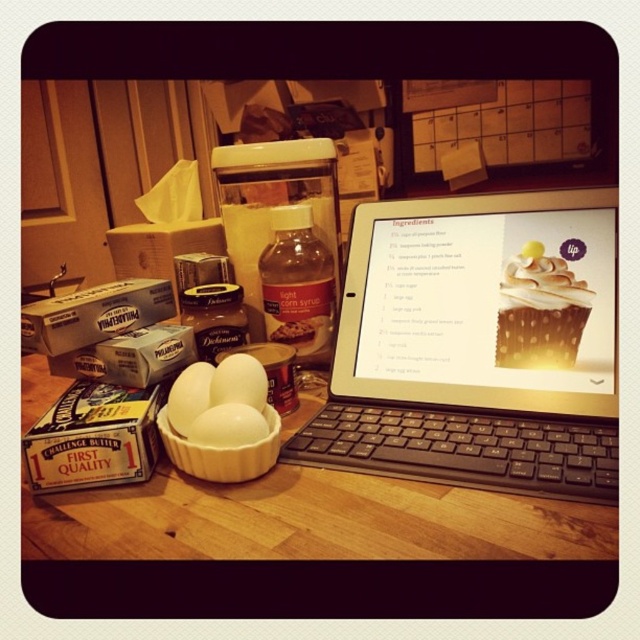
You are a chef trying to reach the smokey brown meringue at upper right while holding the black plastic tablet at center. Can you extend your arm to grab it without moving the tablet?

The distance between the black plastic tablet at center and the smokey brown meringue at upper right is 3.87 inches, so yes, you can extend your arm to grab the smokey brown meringue at upper right without moving the tablet since the distance is within reach.

You are a baker preparing a dessert recipe that requires placing the smokey brown meringue at upper right onto a baking sheet. The baking sheet is positioned at the coordinate point of (541,282). Is the smokey brown meringue at upper right already placed correctly on the baking sheet?

The point (541,282) corresponds to the smokey brown meringue at upper right, so yes, the smokey brown meringue at upper right is already placed correctly on the baking sheet.

You are a chef trying to reach the white glossy egg at center on the wooden table at center. Can you place your hand directly above the egg without touching the table?

The wooden table at center is below the white glossy egg at center, so yes, you can place your hand directly above the egg without touching the table.